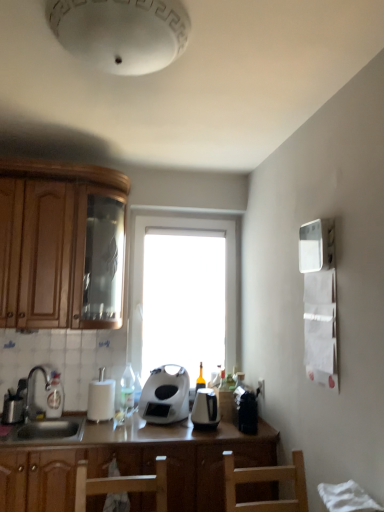
Locate an element on the screen. This screenshot has width=384, height=512. vacant area that is situated to the right of black plastic kettle at center, marked as the 2th kitchen appliance in a left-to-right arrangement is located at coordinates pos(231,432).